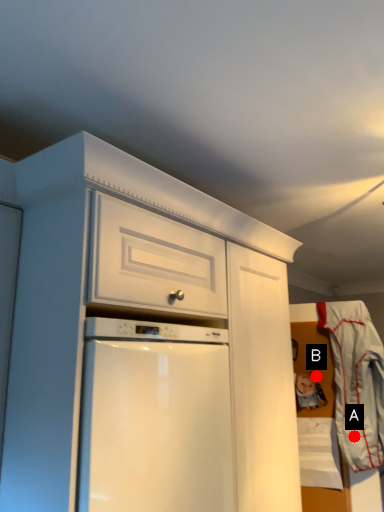
Question: Two points are circled on the image, labeled by A and B beside each circle. Among these points, which one is farthest from the camera?

Choices:
 (A) A is further
 (B) B is further

Answer: (B)